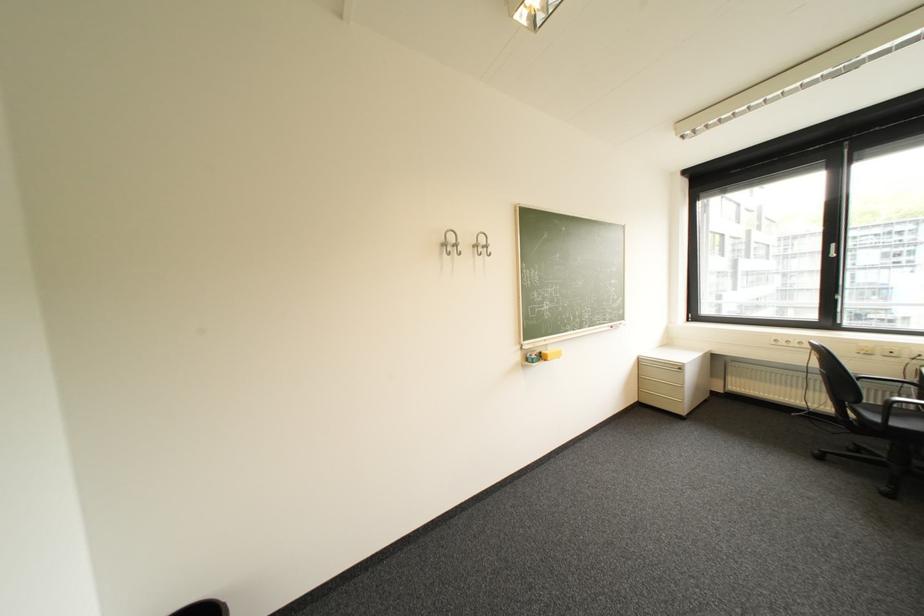
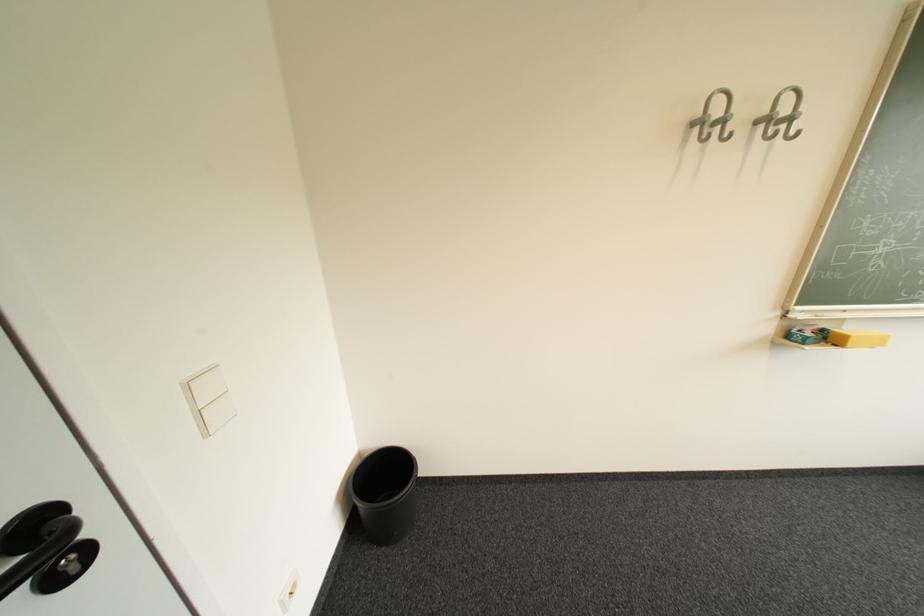
In the second image, find the point that corresponds to (458,243) in the first image.

(720, 116)